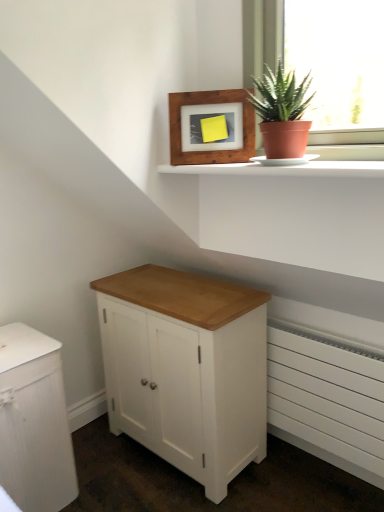
Where is `free space in front of white matte radiator at lower right`? free space in front of white matte radiator at lower right is located at coordinates (317, 496).